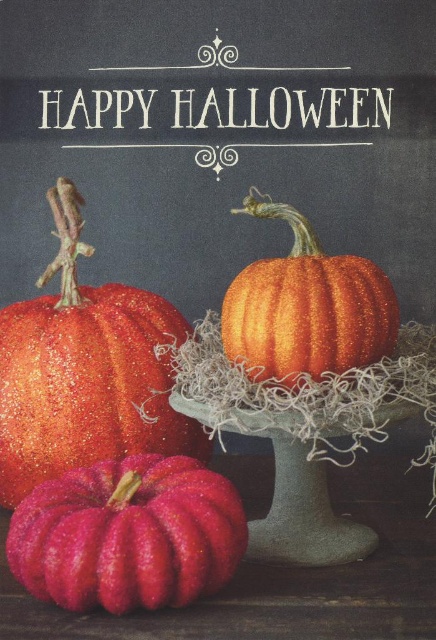
Does glittery orange pumpkin at lower left come in front of sparkly orange pumpkin at center?

No, glittery orange pumpkin at lower left is behind sparkly orange pumpkin at center.

Does glittery orange pumpkin at lower left come behind sparkly orange pumpkin at center?

That is True.

Which is behind, point (190, 448) or point (254, 262)?

Positioned behind is point (190, 448).

In order to click on glittery orange pumpkin at lower left in this screenshot , I will do `click(87, 385)`.

Is glittery orange pumpkin at lower left positioned before shiny pink pumpkin at lower left?

No.

Where is `glittery orange pumpkin at lower left`? glittery orange pumpkin at lower left is located at coordinates (87, 385).

Locate an element on the screen. This screenshot has width=436, height=640. glittery orange pumpkin at lower left is located at coordinates (87, 385).

Describe the element at coordinates (128, 534) in the screenshot. Image resolution: width=436 pixels, height=640 pixels. I see `shiny pink pumpkin at lower left` at that location.

Can you confirm if shiny pink pumpkin at lower left is positioned to the left of sparkly orange pumpkin at center?

Yes, shiny pink pumpkin at lower left is to the left of sparkly orange pumpkin at center.

Which is behind, point (108, 500) or point (364, 304)?

Point (364, 304)

Locate an element on the screen. shiny pink pumpkin at lower left is located at coordinates (128, 534).